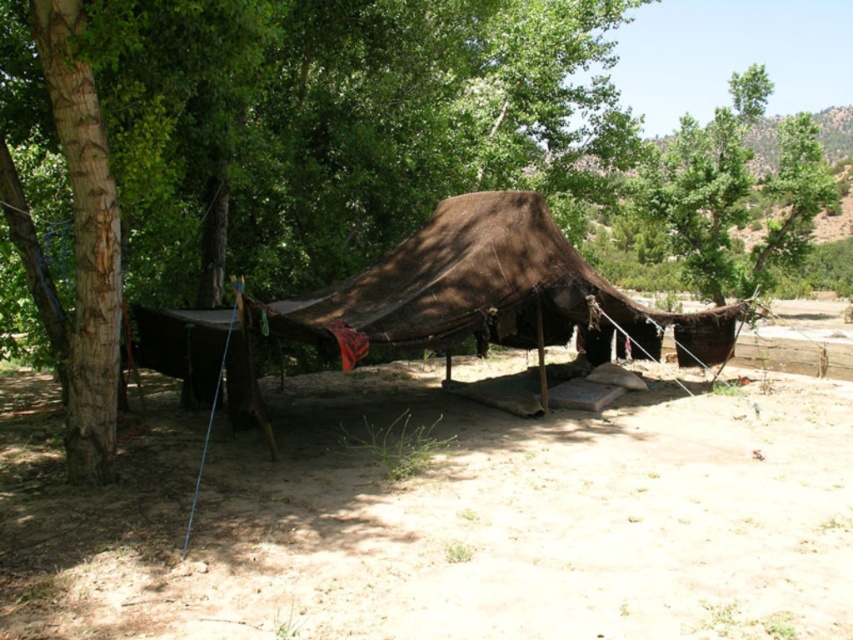
Question: Which point is closer to the camera taking this photo?

Choices:
 (A) (198, 630)
 (B) (438, 230)

Answer: (A)

Question: Can you confirm if brown dirt field at center is wider than brown canvas tent at center?

Choices:
 (A) no
 (B) yes

Answer: (B)

Question: Which object is farther from the camera taking this photo?

Choices:
 (A) brown dirt field at center
 (B) brown canvas tent at center

Answer: (B)

Question: Does brown dirt field at center appear on the left side of brown canvas tent at center?

Choices:
 (A) yes
 (B) no

Answer: (B)

Question: Observing the image, what is the correct spatial positioning of brown dirt field at center in reference to brown canvas tent at center?

Choices:
 (A) below
 (B) above

Answer: (A)

Question: Among these points, which one is nearest to the camera?

Choices:
 (A) (358, 358)
 (B) (262, 608)

Answer: (B)